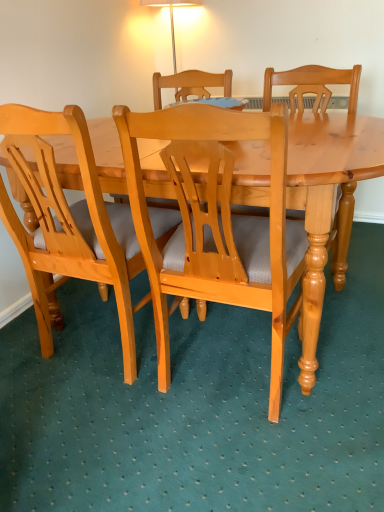
This screenshot has width=384, height=512. I want to click on free point below matte wood chair at center, the 2th chair in the right-to-left sequence (from a real-world perspective), so click(x=117, y=346).